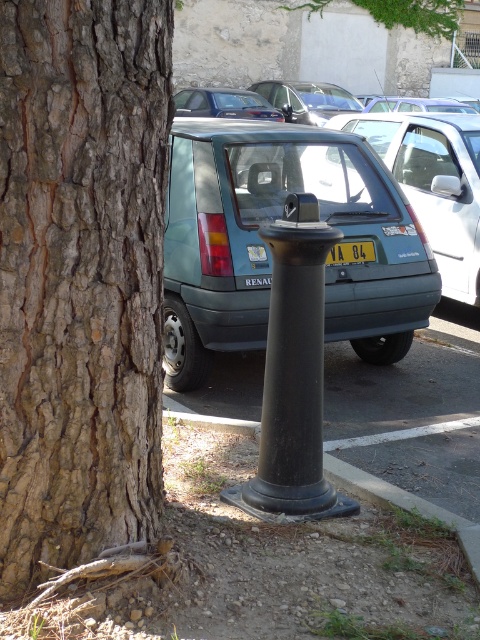
You are a delivery person trying to park your 6 feet tall delivery box. You see the teal matte hatchback at center and the yellow plastic license plate at center. Which object is taller and can accommodate your box?

The teal matte hatchback at center is much taller than the yellow plastic license plate at center, so it can accommodate your 6 feet tall delivery box.

You are a delivery driver who needs to park your van between the black matte pole at center and the black rubber post at lower center. Your van is 2 meters wide. Can you fit your van between them?

The black matte pole at center is wider than the black rubber post at lower center. Since the van is 2 meters wide, but the description only mentions their widths relative to each other without specific measurements, it is unclear if there is enough space. Please check the actual distance between them before attempting to park.